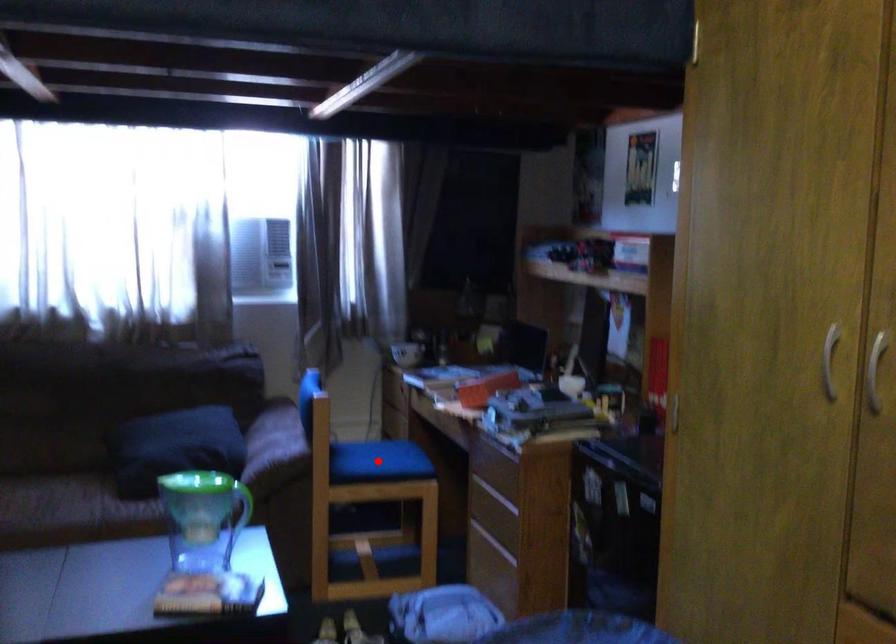
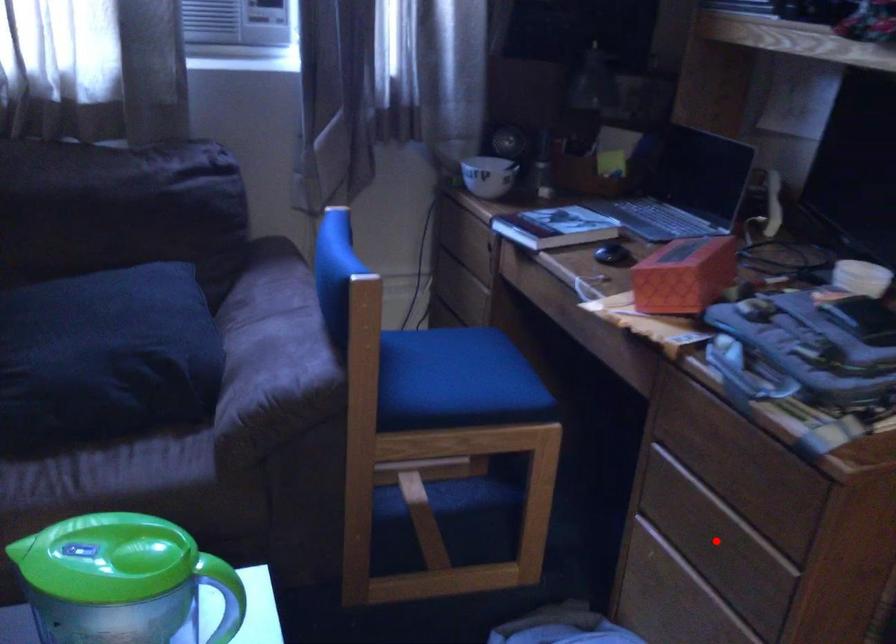
I am providing you with two images of the same scene from different viewpoints. A red point is marked on the first image and another point is marked on the second image. Is the red point in image1 aligned with the point shown in image2?

No